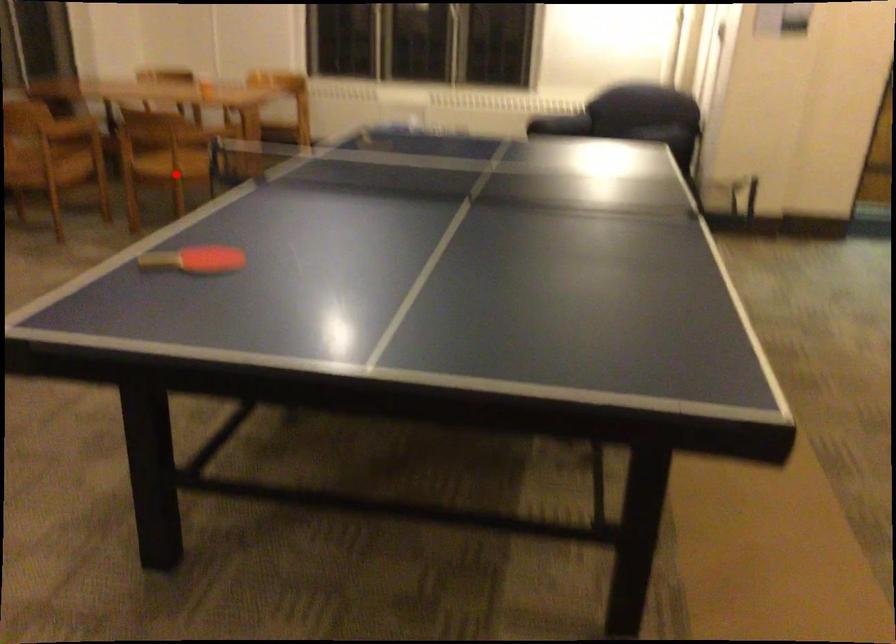
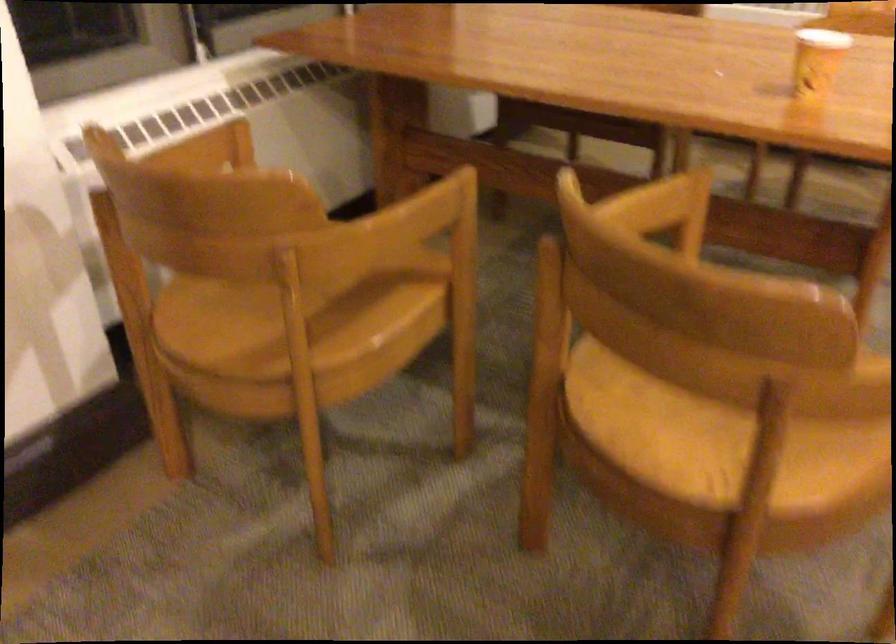
Where in the second image is the point corresponding to the highlighted location from the first image?

(704, 433)